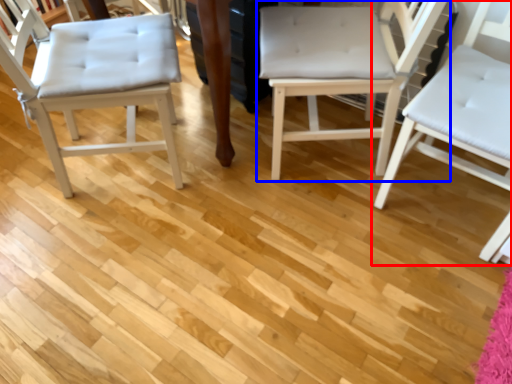
Question: Among these objects, which one is farthest to the camera, chair (highlighted by a red box) or chair (highlighted by a blue box)?

Choices:
 (A) chair
 (B) chair

Answer: (B)